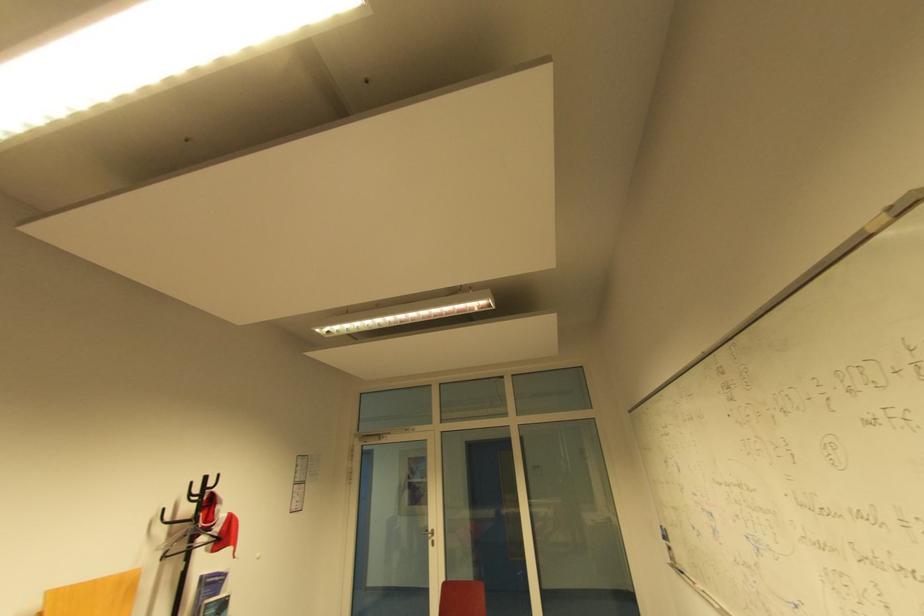
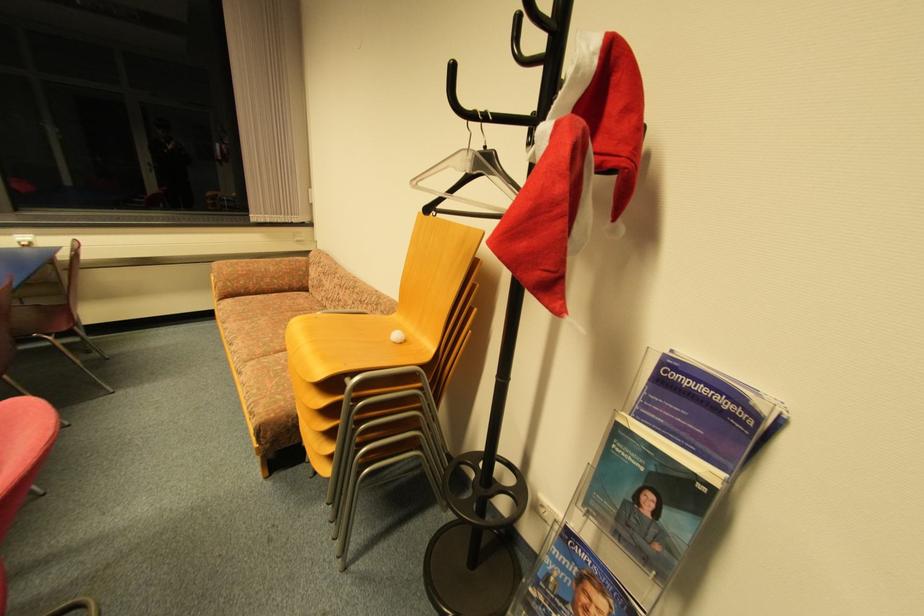
In the second image, find the point that corresponds to pixel 216 581 in the first image.

(708, 391)